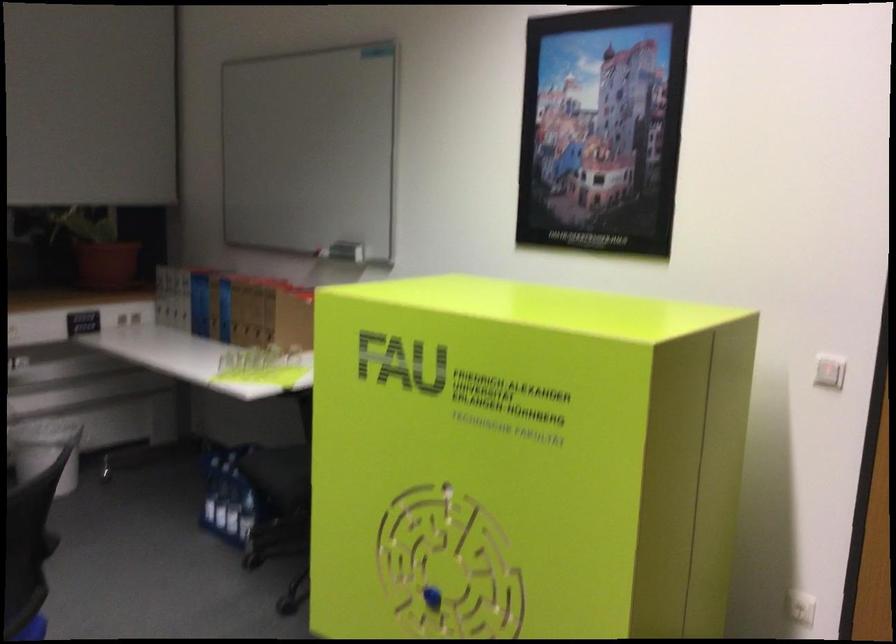
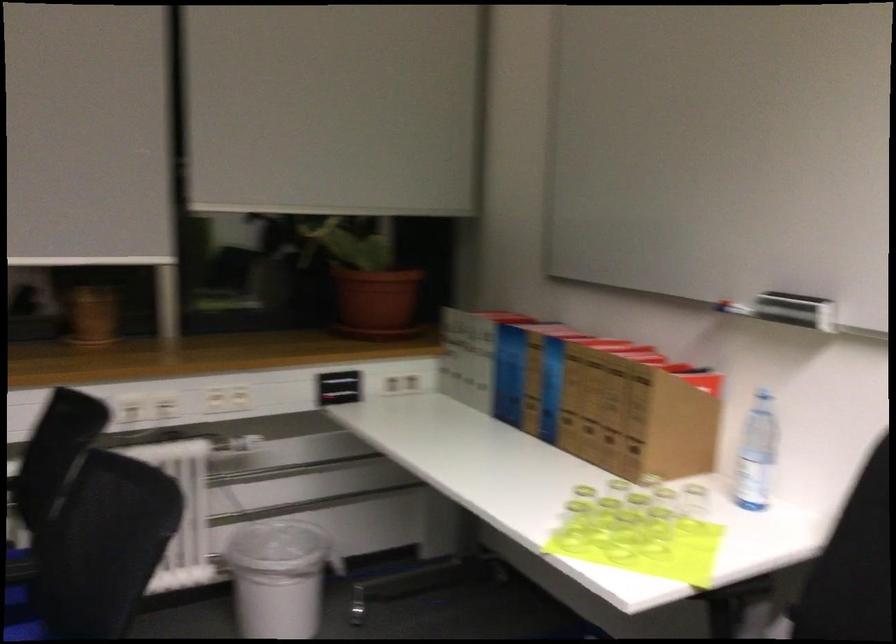
Locate, in the second image, the point that corresponds to point 257,373 in the first image.

(623, 536)